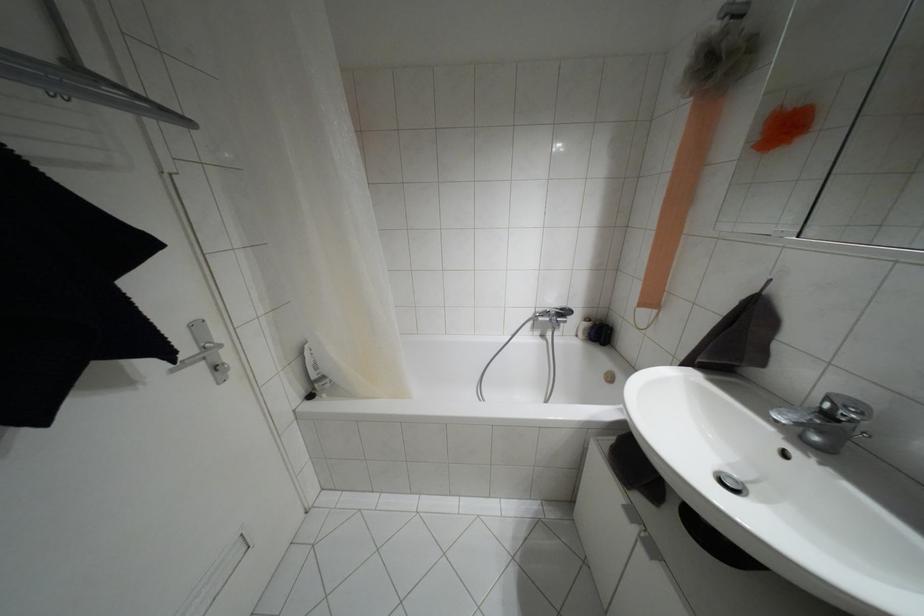
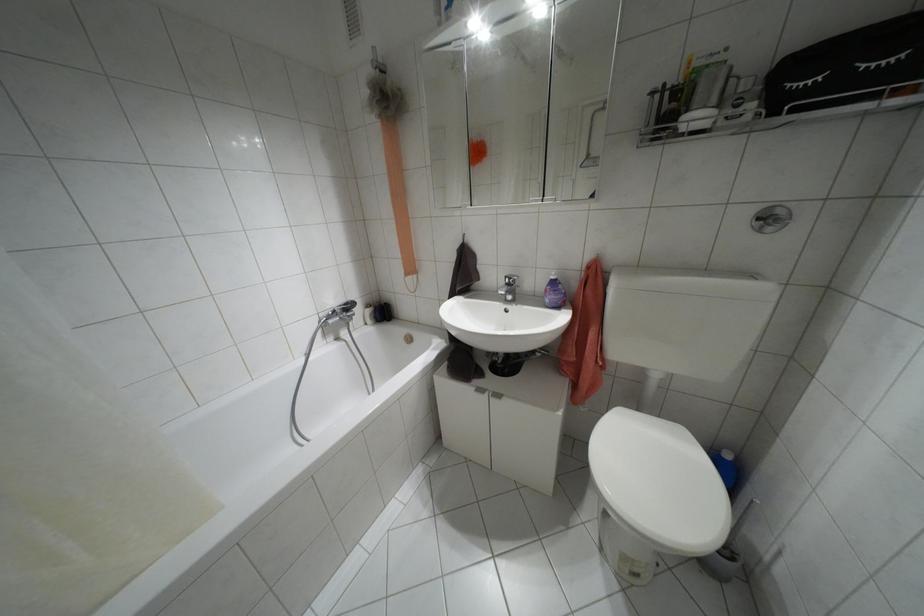
Question: Based on the continuous images, in which direction is the camera rotating? Reply with the corresponding letter.

Choices:
 (A) Left
 (B) Right
 (C) Up
 (D) Down

Answer: (B)